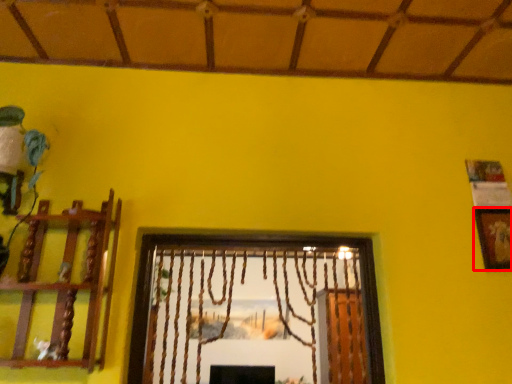
Question: From the image's perspective, what is the correct spatial positioning of picture frame (annotated by the red box) in reference to shelf?

Choices:
 (A) above
 (B) below

Answer: (A)